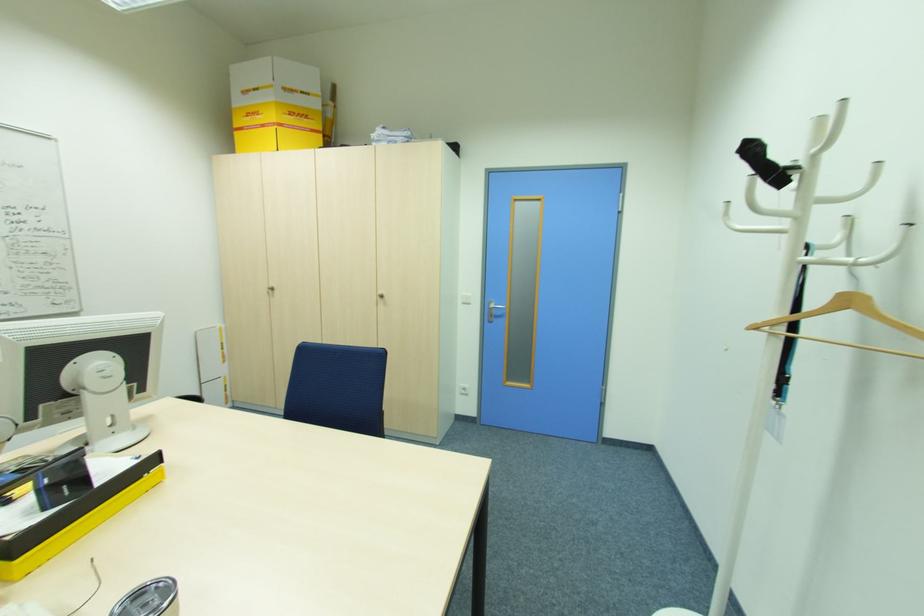
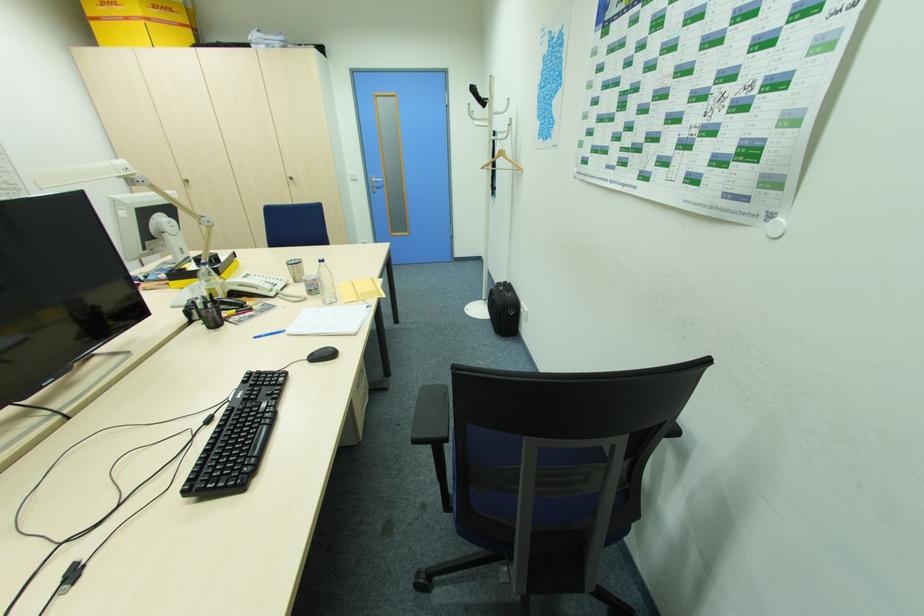
The point at (x=383, y=293) is marked in the first image. Where is the corresponding point in the second image?

(292, 176)